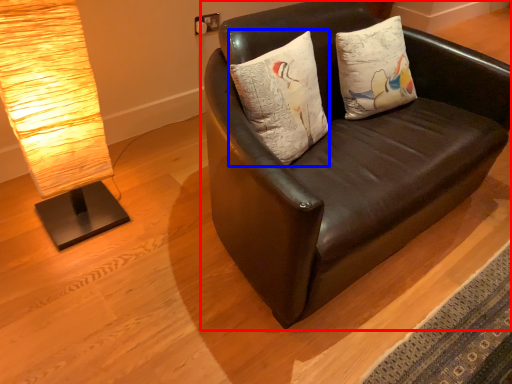
Question: Which object appears farthest to the camera in this image, studio couch (highlighted by a red box) or pillow (highlighted by a blue box)?

Choices:
 (A) studio couch
 (B) pillow

Answer: (B)